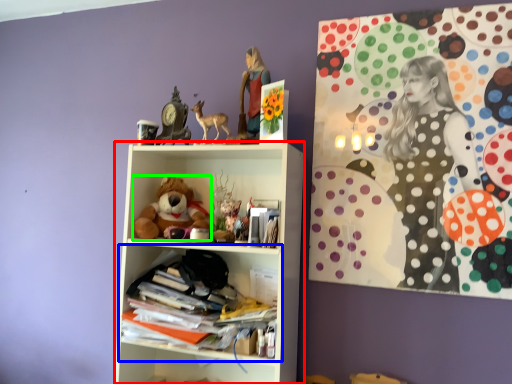
Question: Which object is positioned closest to shelf (highlighted by a red box)? Select from shelf (highlighted by a blue box) and teddy bear (highlighted by a green box).

Choices:
 (A) shelf
 (B) teddy bear

Answer: (A)